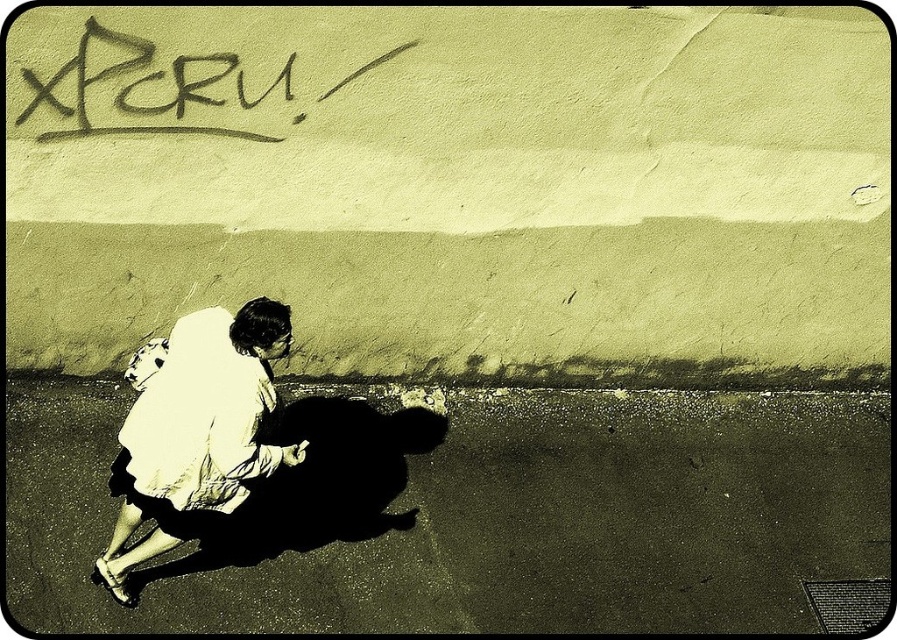
You are a street artist planning to add a new mural. You see the dark asphalt pavement at lower left and the black graffiti at upper left. Which surface has a larger area for your artwork?

The dark asphalt pavement at lower left has a larger area than the black graffiti at upper left, so it would be better for your mural.

You are a photographer trying to capture both the white cotton shirt at lower left and the black graffiti at upper left in the same frame. Given their sizes, which object would you need to move closer to in order to ensure both fit properly in the photo?

Since the white cotton shirt at lower left is larger than the black graffiti at upper left, you should move closer to the white cotton shirt at lower left to ensure its details are captured while still framing the black graffiti at upper left in the background.